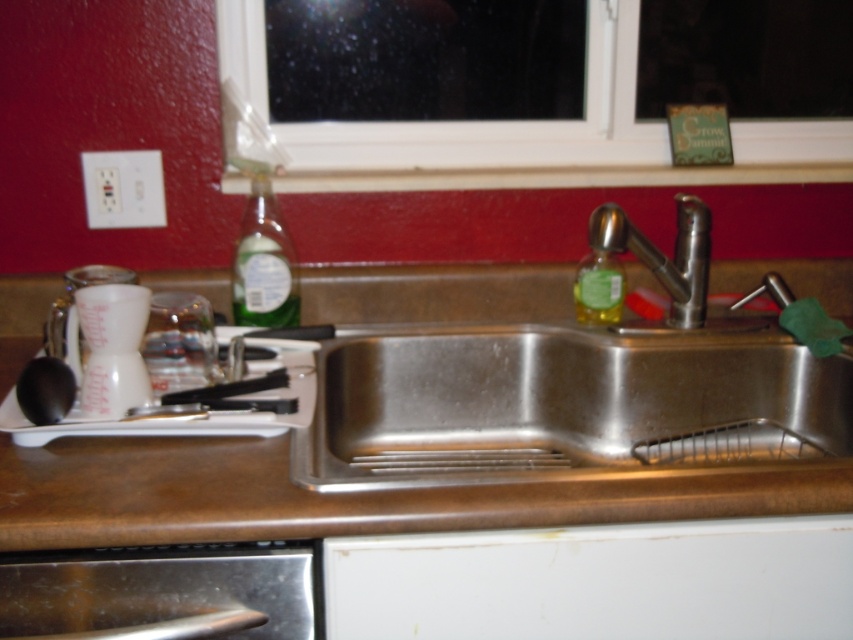
Question: Does white plastic window at upper center appear on the left side of green glass bottle at upper right?

Choices:
 (A) yes
 (B) no

Answer: (A)

Question: Among these objects, which one is nearest to the camera?

Choices:
 (A) white plastic tray at left
 (B) brushed metal dishwasher at lower left

Answer: (B)

Question: Is polished stainless steel faucet at center positioned behind green glass bottle at upper right?

Choices:
 (A) yes
 (B) no

Answer: (B)

Question: Based on their relative distances, which object is farther from the green glass bottle at upper right?

Choices:
 (A) translucent green liquid at sink left
 (B) polished stainless steel faucet at center
 (C) white plastic window at upper center
 (D) stainless steel sink at center

Answer: (A)

Question: Which object is the closest to the brown matte counter top at center?

Choices:
 (A) white plastic tray at left
 (B) polished stainless steel faucet at center
 (C) brushed metal dishwasher at lower left

Answer: (A)

Question: Can you confirm if brown matte counter top at center is positioned below white plastic tray at left?

Choices:
 (A) yes
 (B) no

Answer: (A)